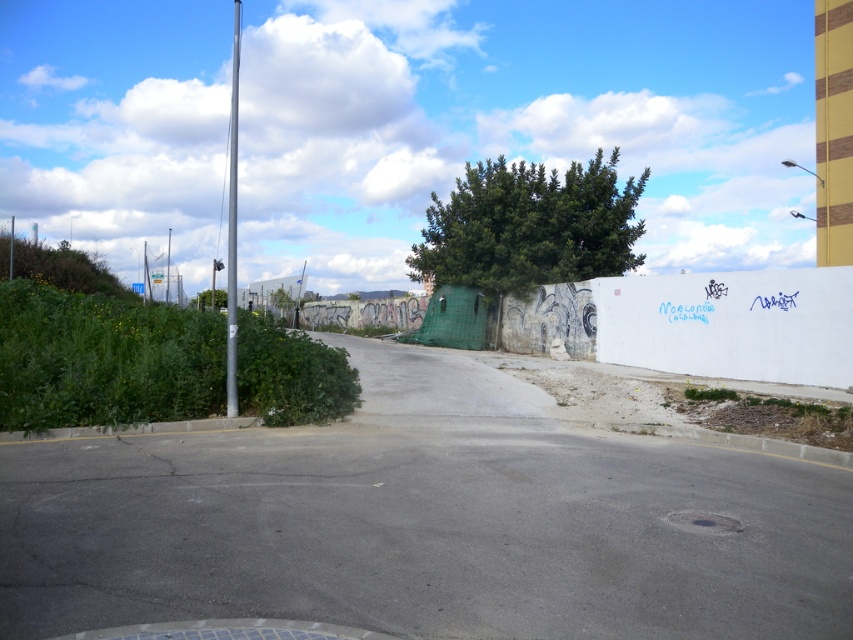
Question: Which point is farther to the camera?

Choices:
 (A) silver metallic pole at upper left
 (B) silver metallic pole at left
 (C) green leafy tree at center

Answer: (A)

Question: Which point is farther to the camera?

Choices:
 (A) green leafy tree at center
 (B) blue plastic sign at upper left
 (C) green leafy tree at left

Answer: (C)

Question: Is green leafy tree at center to the right of blue plastic sign at upper left from the viewer's perspective?

Choices:
 (A) no
 (B) yes

Answer: (B)

Question: Which object is positioned farthest from the blue plastic sign at upper left?

Choices:
 (A) silver metallic pole at left
 (B) silver metallic pole at upper left
 (C) green leafy tree at left

Answer: (A)

Question: From the image, what is the correct spatial relationship of green matte tree at center in relation to silver metallic pole at upper left?

Choices:
 (A) left
 (B) right

Answer: (B)

Question: Is silver metallic pole at left above green matte tree at center?

Choices:
 (A) no
 (B) yes

Answer: (B)